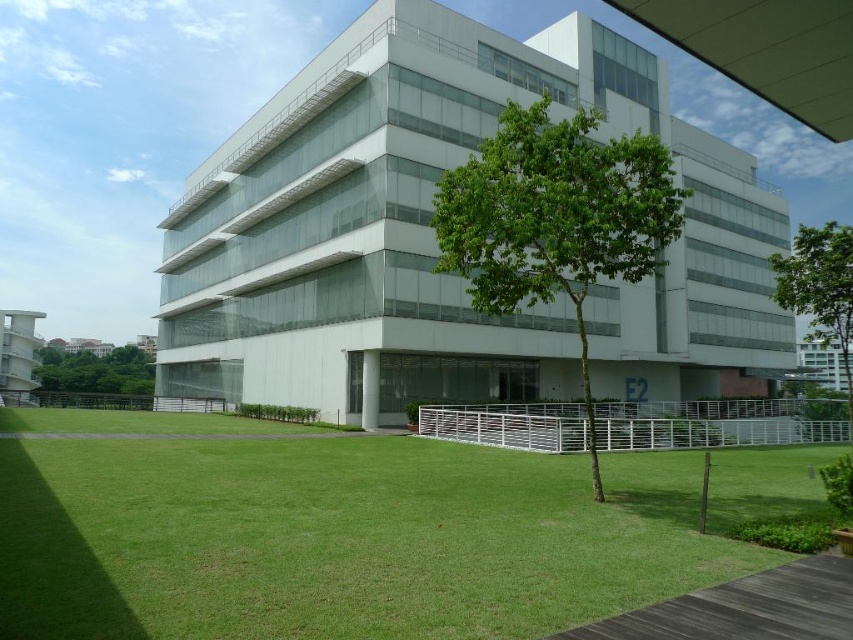
Who is higher up, green grass at lower center or green leafy tree at lower left?

green grass at lower center is above.

Is point (556, 461) positioned in front of point (91, 401)?

That is True.

The height and width of the screenshot is (640, 853). I want to click on green grass at lower center, so click(x=354, y=531).

Based on the photo, is green grass at lower center taller than green leafy tree at right?

No, green grass at lower center is not taller than green leafy tree at right.

Can you confirm if green grass at lower center is positioned below green leafy tree at right?

Yes, green grass at lower center is below green leafy tree at right.

Identify the location of green grass at lower center. (354, 531).

Locate an element on the screen. Image resolution: width=853 pixels, height=640 pixels. green grass at lower center is located at coordinates (354, 531).

Who is positioned more to the right, green grass at lower center or green leafy tree at center?

green leafy tree at center is more to the right.

Is point (73, 632) positioned in front of point (549, 212)?

That is True.

The image size is (853, 640). In order to click on green grass at lower center in this screenshot , I will do `click(354, 531)`.